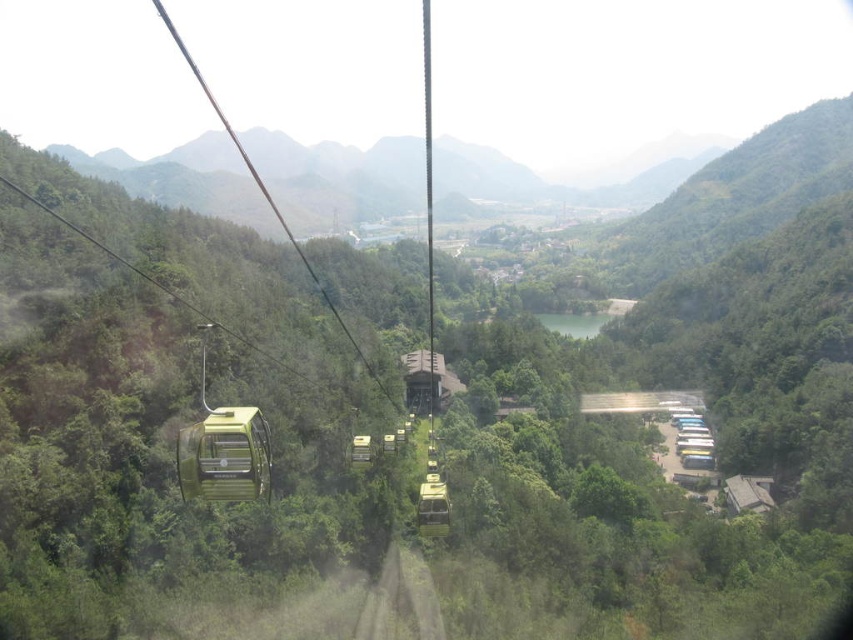
Question: Which of the following is the closest to the observer?

Choices:
 (A) (213, 444)
 (B) (431, 224)

Answer: (A)

Question: Is green matte/glossy cable car at center closer to camera compared to metallic green cable car at left?

Choices:
 (A) no
 (B) yes

Answer: (A)

Question: Which object appears farthest from the camera in this image?

Choices:
 (A) green matte/glossy cable car at center
 (B) metallic green cable car at left

Answer: (A)

Question: Can you confirm if green matte/glossy cable car at center is positioned below metallic green cable car at left?

Choices:
 (A) yes
 (B) no

Answer: (B)

Question: Can you confirm if green matte/glossy cable car at center is bigger than metallic green cable car at left?

Choices:
 (A) no
 (B) yes

Answer: (B)